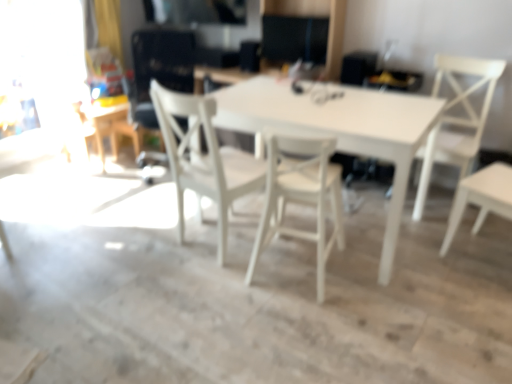
Question: Is white matte table at center, marked as the second table in a left-to-right arrangement, wider or thinner than white matte chair at right, acting as the first chair starting from the right?

Choices:
 (A) thin
 (B) wide

Answer: (B)

Question: Does point (309, 104) appear closer or farther from the camera than point (483, 104)?

Choices:
 (A) closer
 (B) farther

Answer: (A)

Question: Which object is positioned farthest from the white matte table at center, the 2th table from the back?

Choices:
 (A) white matte table at upper left, which ranks as the 1th table in back-to-front order
 (B) white wood chair at center, which ranks as the 1th chair in left-to-right order
 (C) white wood chair at center, the 2th chair from the left
 (D) transparent glass door at upper left
 (E) white matte chair at right, arranged as the third chair when viewed from the left

Answer: (D)

Question: Considering the real-world distances, which object is closest to the white matte chair at right, arranged as the third chair when viewed from the left?

Choices:
 (A) white wood chair at center, positioned as the second chair in right-to-left order
 (B) white matte table at upper left, which ranks as the 1th table in back-to-front order
 (C) transparent glass door at upper left
 (D) white wood chair at center, placed as the 3th chair when sorted from right to left
 (E) white matte table at center, the 2th table from the back

Answer: (E)